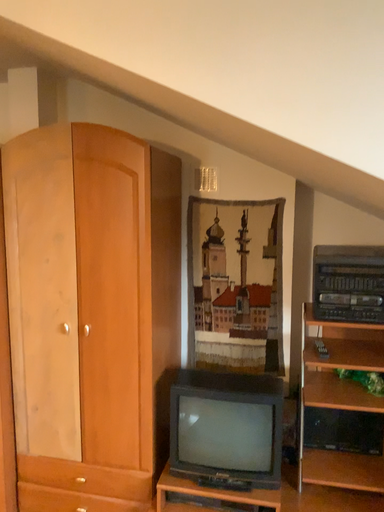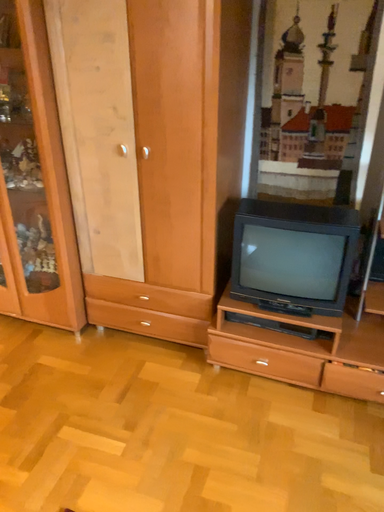
Question: How did the camera likely rotate when shooting the video?

Choices:
 (A) rotated upward
 (B) rotated downward

Answer: (B)